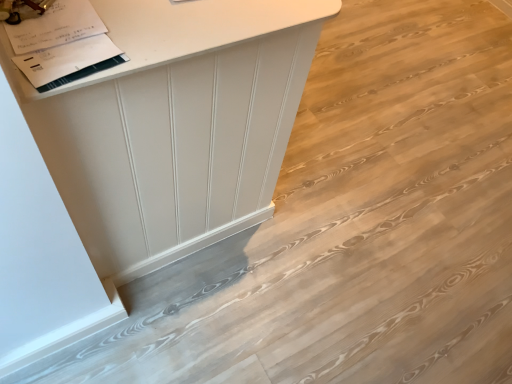
Where is `white matte cabinet at upper left`? The width and height of the screenshot is (512, 384). white matte cabinet at upper left is located at coordinates (175, 125).

Describe the element at coordinates (175, 125) in the screenshot. This screenshot has width=512, height=384. I see `white matte cabinet at upper left` at that location.

The height and width of the screenshot is (384, 512). In order to click on white matte cabinet at upper left in this screenshot , I will do `click(175, 125)`.